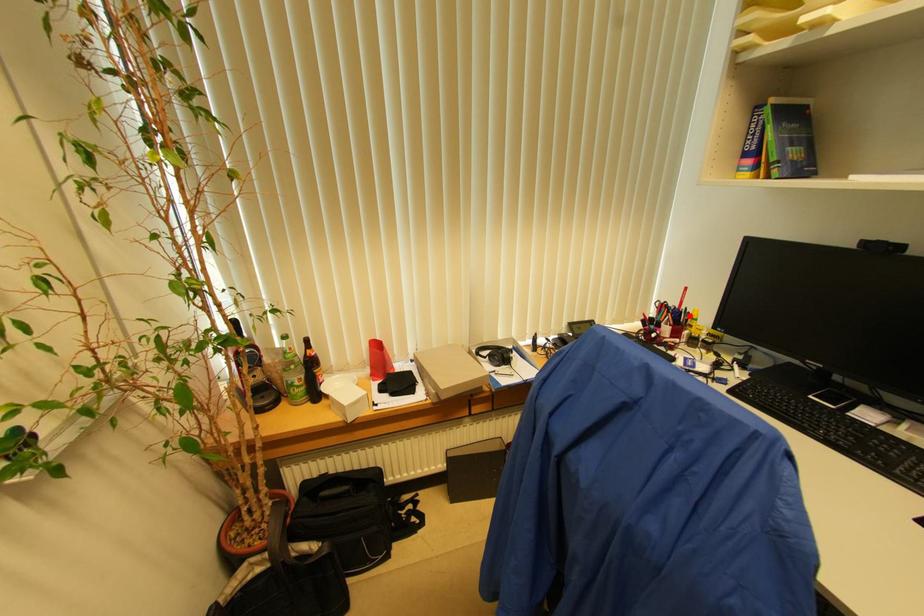
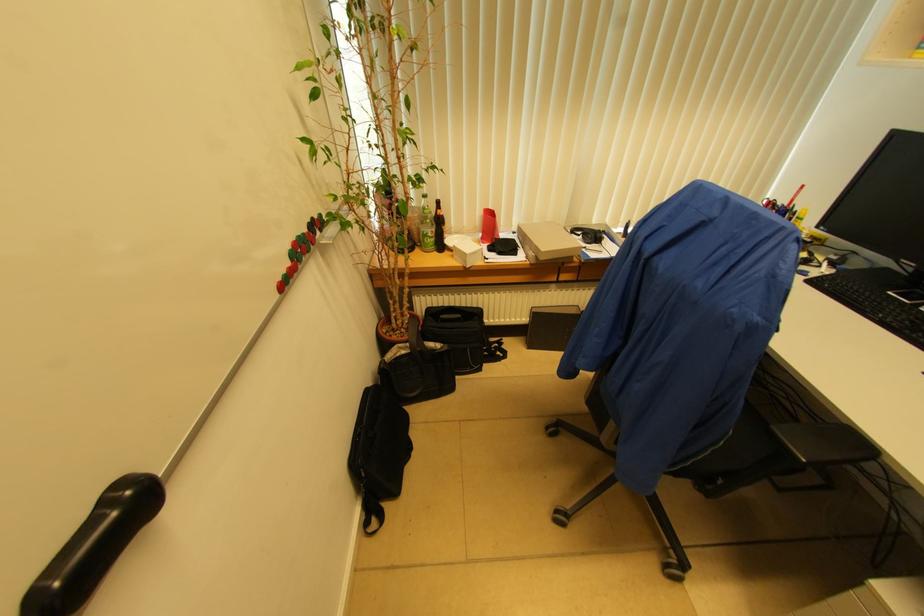
Find the pixel in the second image that matches the highlighted location in the first image.

(796, 215)